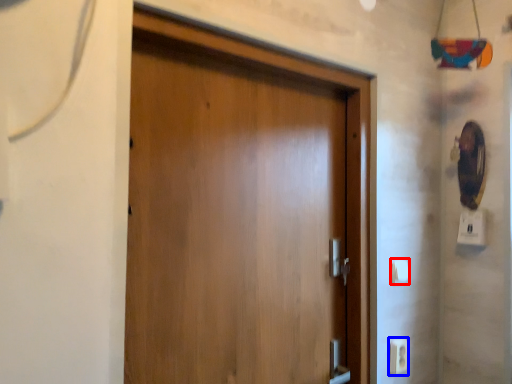
Question: Which object is closer to the camera taking this photo, light switch (highlighted by a red box) or electric outlet (highlighted by a blue box)?

Choices:
 (A) light switch
 (B) electric outlet

Answer: (B)